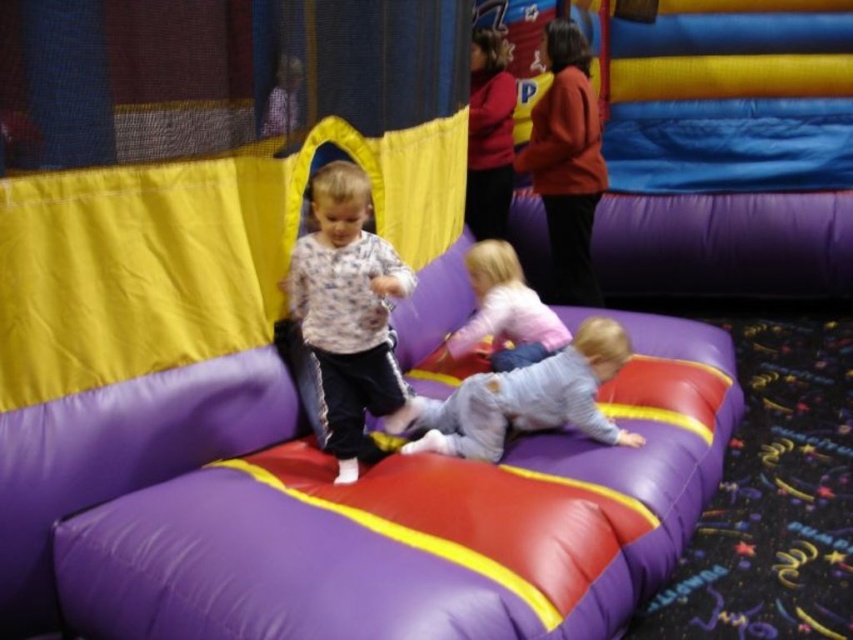
Question: Is gray fabric boy at lower center closer to camera compared to light pink fabric toddler at center?

Choices:
 (A) yes
 (B) no

Answer: (A)

Question: Which point appears farthest from the camera in this image?

Choices:
 (A) (506, 300)
 (B) (357, 406)

Answer: (A)

Question: Is fluffy white sweater at center behind light pink fabric toddler at center?

Choices:
 (A) no
 (B) yes

Answer: (A)

Question: Which object is positioned closest to the light pink fabric toddler at center?

Choices:
 (A) gray fabric boy at lower center
 (B) fluffy white sweater at center

Answer: (A)

Question: Is gray fabric boy at lower center to the right of light pink fabric toddler at center from the viewer's perspective?

Choices:
 (A) yes
 (B) no

Answer: (A)

Question: Estimate the real-world distances between objects in this image. Which object is closer to the fluffy white sweater at center?

Choices:
 (A) gray fabric boy at lower center
 (B) light pink fabric toddler at center

Answer: (A)